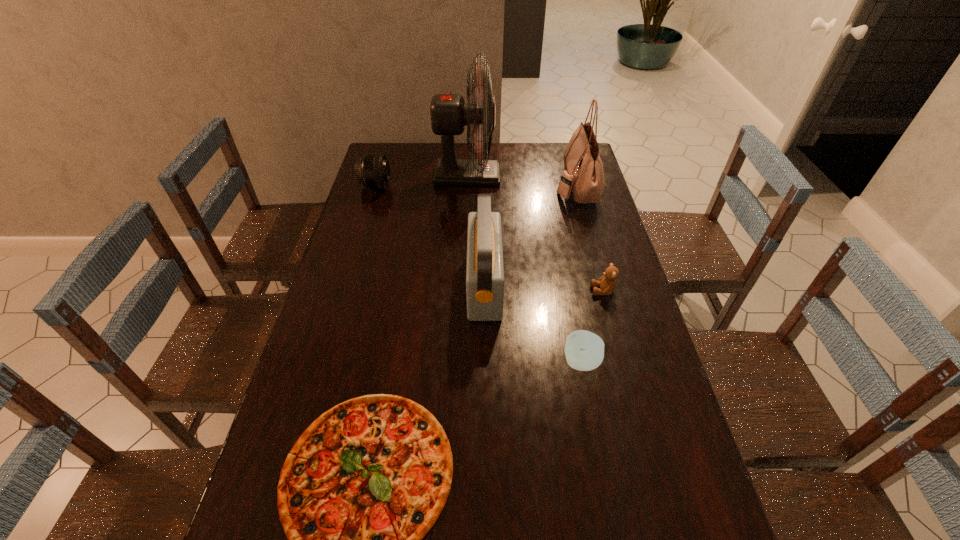
Identify the location of unoccupied position between the fourth shortest object and the tallest object. The width and height of the screenshot is (960, 540). (421, 181).

Locate an element on the screen. vacant space that's between the handbag and the teddy bear is located at coordinates (589, 238).

Locate an element on the screen. The width and height of the screenshot is (960, 540). object that can be found as the third closest to the nearest object is located at coordinates (607, 283).

Point out which object is positioned as the sixth nearest to the pizza. Please provide its 2D coordinates. Your answer should be formatted as a tuple, i.e. [(x, y)], where the tuple contains the x and y coordinates of a point satisfying the conditions above.

[(372, 170)]

You are a GUI agent. You are given a task and a screenshot of the screen. Output one action in this format:
    pyautogui.click(x=<x>, y=<y>)
    Task: Click on the vacant space that satisfies the following two spatial constraints: 1. on the front-facing side of the apple; 2. on the right side of the fan
    
    Given the screenshot: What is the action you would take?
    pyautogui.click(x=461, y=362)

The height and width of the screenshot is (540, 960). In order to click on vacant space that satisfies the following two spatial constraints: 1. on the front-facing side of the second nearest object; 2. on the right side of the third tallest object in this screenshot , I will do `click(485, 362)`.